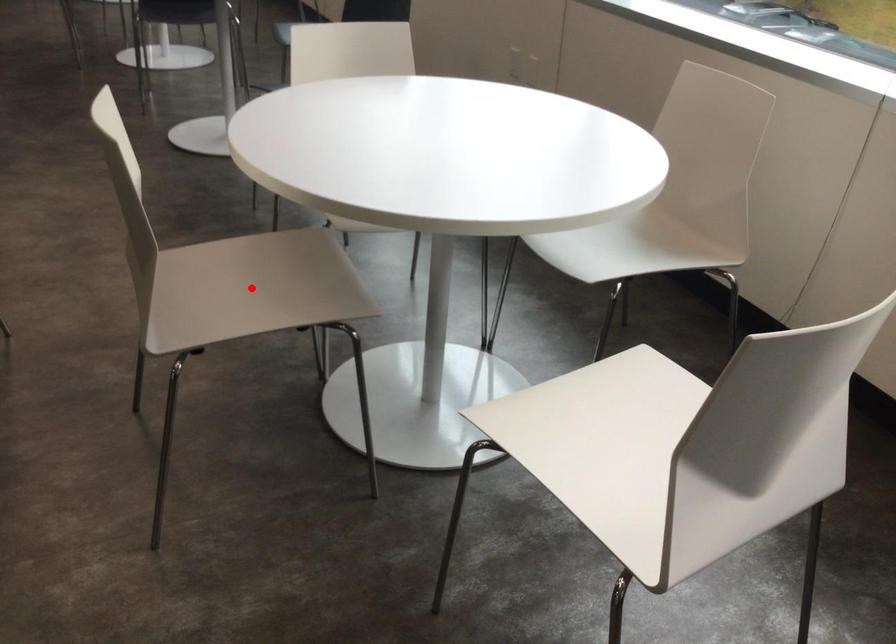
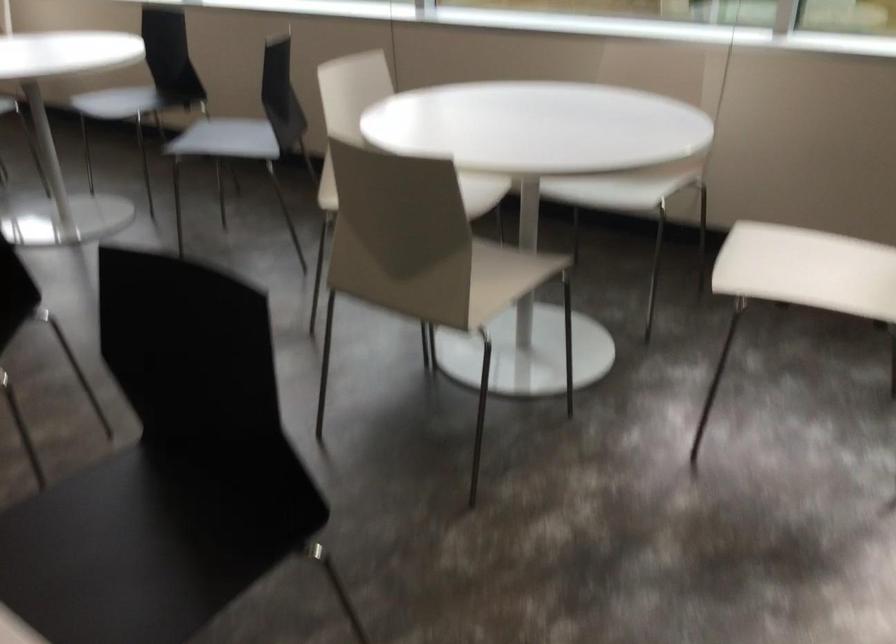
Question: I am providing you with two images of the same scene from different viewpoints. A red point is marked on the first image. At the location where the point appears in image 1, is it still visible in image 2?

Choices:
 (A) Yes
 (B) No

Answer: (B)